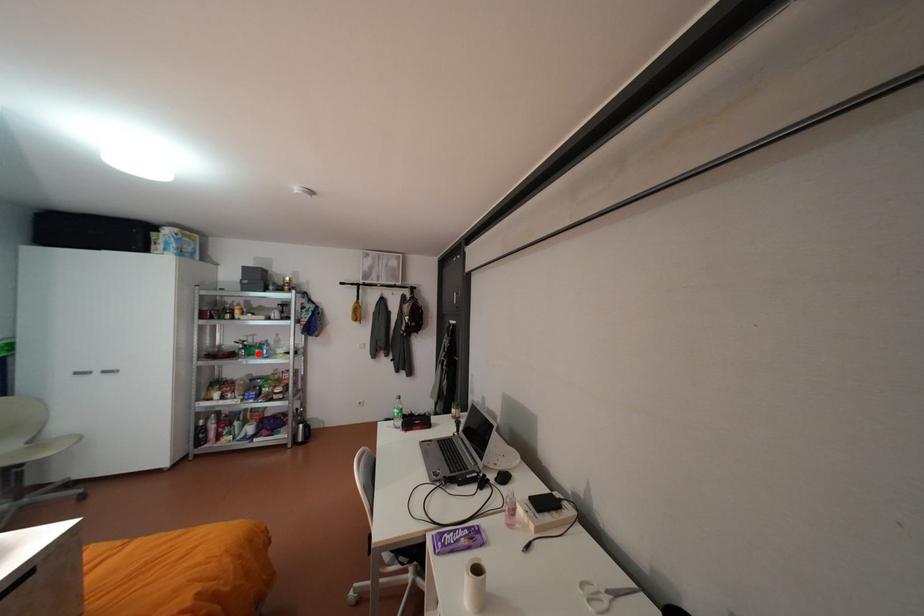
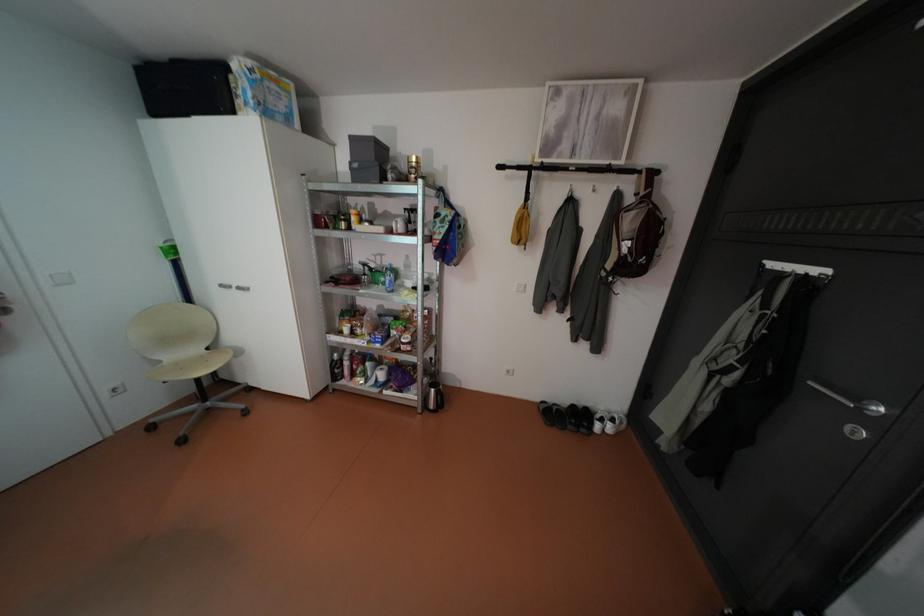
The point at the highlighted location is marked in the first image. Where is the corresponding point in the second image?

(383, 282)